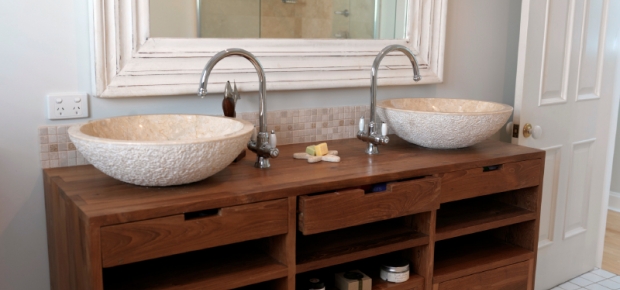
At what (x,y) coordinates should I click in order to perform the action: click on white tile floor. Please return your answer as a coordinate pair (x, y). Image resolution: width=620 pixels, height=290 pixels. Looking at the image, I should click on (600, 277).